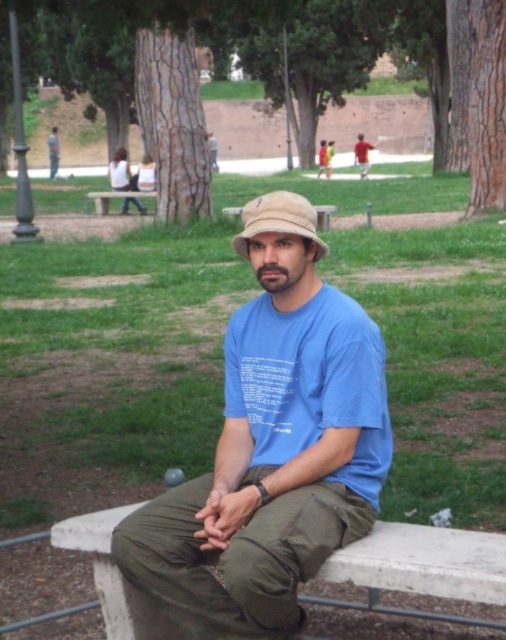
Can you confirm if green bark tree at center is bigger than wooden bench at center?

Yes.

Does point (497, 118) lie in front of point (93, 198)?

Yes.

Identify the location of green bark tree at center. The width and height of the screenshot is (506, 640). (175, 84).

Is blue cotton shirt at center to the right of rough bark tree at upper center from the viewer's perspective?

Indeed, blue cotton shirt at center is positioned on the right side of rough bark tree at upper center.

Is blue cotton shirt at center smaller than rough bark tree at upper center?

Indeed, blue cotton shirt at center has a smaller size compared to rough bark tree at upper center.

Image resolution: width=506 pixels, height=640 pixels. What do you see at coordinates (273, 445) in the screenshot?
I see `blue cotton shirt at center` at bounding box center [273, 445].

This screenshot has width=506, height=640. I want to click on blue cotton shirt at center, so click(273, 445).

Does rough bark tree at upper center have a greater width compared to matte black shirt at center?

Yes.

This screenshot has width=506, height=640. Describe the element at coordinates (172, 109) in the screenshot. I see `rough bark tree at upper center` at that location.

At what (x,y) coordinates should I click in order to perform the action: click on rough bark tree at upper center. Please return your answer as a coordinate pair (x, y). This screenshot has height=640, width=506. Looking at the image, I should click on (172, 109).

Find the location of a particular element. rough bark tree at upper center is located at coordinates coord(172,109).